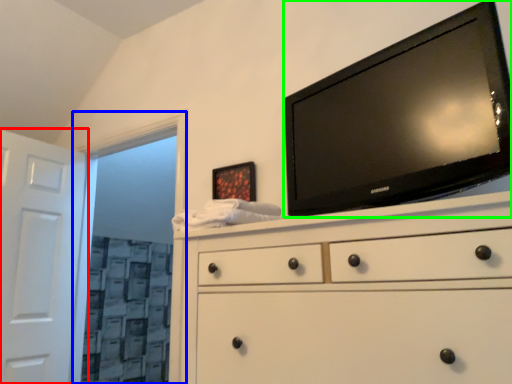
Question: Which object is positioned closest to door (highlighted by a red box)? Select from glass door (highlighted by a blue box) and television (highlighted by a green box).

Choices:
 (A) glass door
 (B) television

Answer: (A)